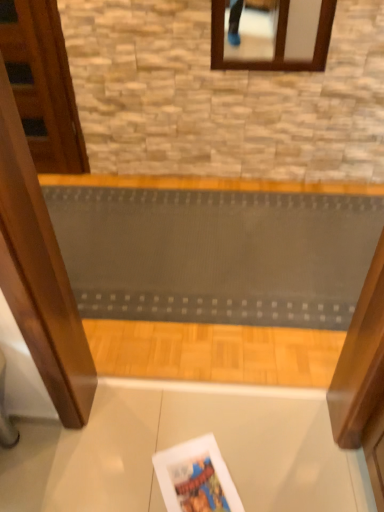
Find the location of `free space above matte paper magazine at lower center (from a real-world perspective)`. free space above matte paper magazine at lower center (from a real-world perspective) is located at coordinates pos(203,471).